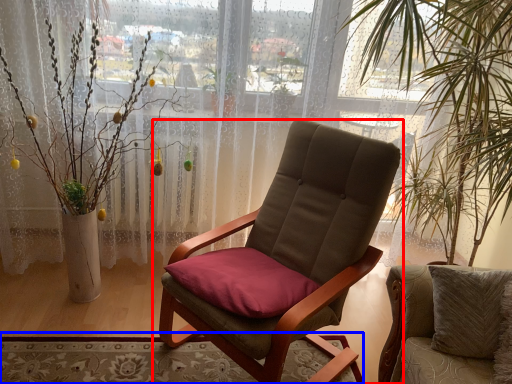
Question: Which of the following is the closest to the observer, chair (highlighted by a red box) or mat (highlighted by a blue box)?

Choices:
 (A) chair
 (B) mat

Answer: (A)